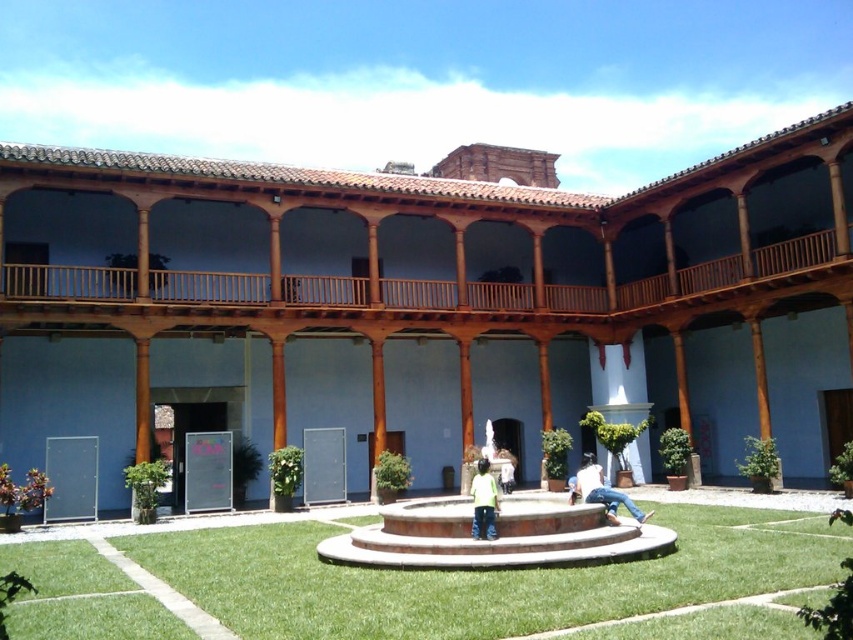
Question: Is blue painted walls at center wider than brown stone fountain at center?

Choices:
 (A) yes
 (B) no

Answer: (A)

Question: Considering the real-world distances, which object is farthest from the green matte shirt at center?

Choices:
 (A) green grass at center
 (B) blue painted walls at center
 (C) denim jeans at center

Answer: (B)

Question: Which of the following is the closest to the observer?

Choices:
 (A) brown stone fountain at center
 (B) blue painted walls at center

Answer: (A)

Question: Which object appears farthest from the camera in this image?

Choices:
 (A) green matte shirt at center
 (B) denim jeans at center
 (C) brown stone fountain at center
 (D) green grass at center

Answer: (B)

Question: Does blue painted walls at center lie behind denim jeans at center?

Choices:
 (A) no
 (B) yes

Answer: (B)

Question: Does blue painted walls at center appear over brown stone fountain at center?

Choices:
 (A) no
 (B) yes

Answer: (B)